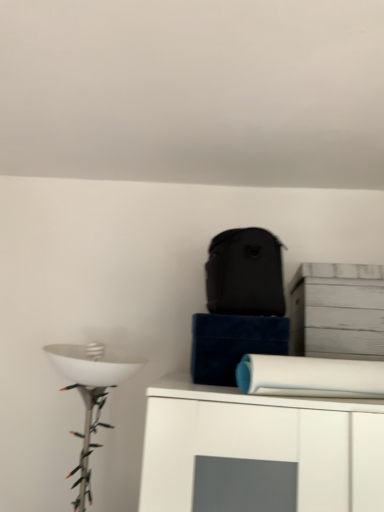
Question: Based on their sizes in the image, would you say white wood cabinet at upper right is bigger or smaller than white matte toilet paper at upper right?

Choices:
 (A) small
 (B) big

Answer: (A)

Question: Does point (349, 294) appear closer or farther from the camera than point (289, 373)?

Choices:
 (A) farther
 (B) closer

Answer: (A)

Question: Is white wood cabinet at upper right taller or shorter than white matte toilet paper at upper right?

Choices:
 (A) tall
 (B) short

Answer: (A)

Question: In the image, is white matte toilet paper at upper right on the left side or the right side of white wood cabinet at upper right?

Choices:
 (A) right
 (B) left

Answer: (B)

Question: Do you think white matte toilet paper at upper right is within white wood cabinet at upper right, or outside of it?

Choices:
 (A) inside
 (B) outside

Answer: (B)

Question: Is white matte toilet paper at upper right bigger or smaller than white wood cabinet at upper right?

Choices:
 (A) big
 (B) small

Answer: (A)

Question: Considering their positions, is white matte toilet paper at upper right located in front of or behind white wood cabinet at upper right?

Choices:
 (A) behind
 (B) front

Answer: (B)